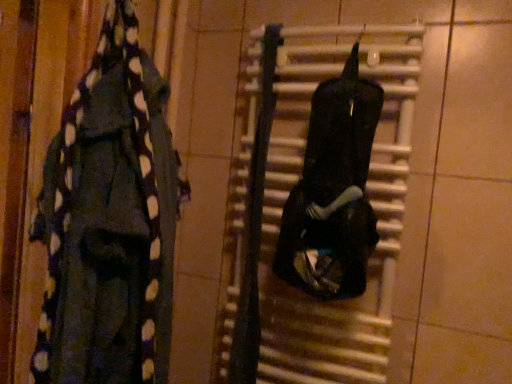
The width and height of the screenshot is (512, 384). I want to click on free point above black matte radiator at center (from a real-world perspective), so click(x=340, y=30).